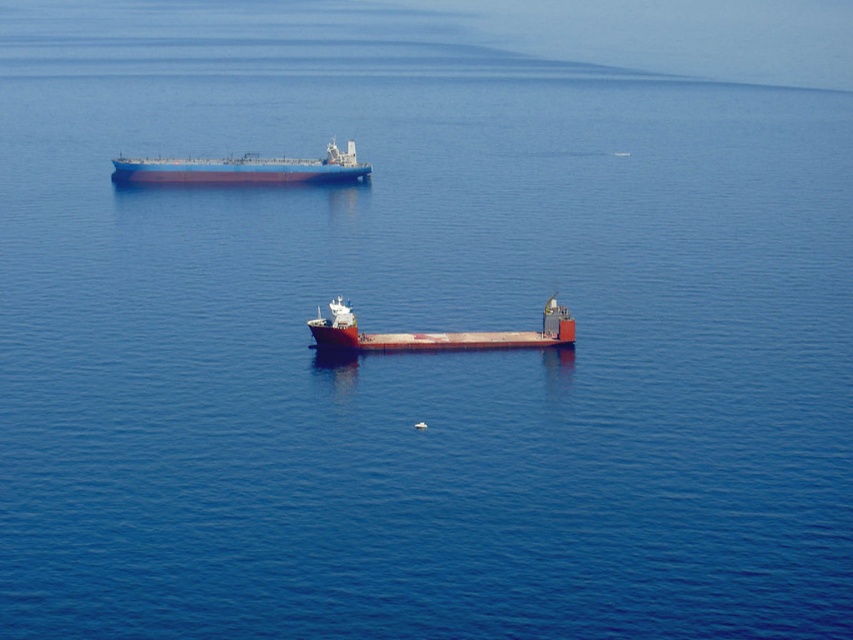
Question: Which object appears closest to the camera in this image?

Choices:
 (A) blue matte tanker at upper left
 (B) smooth red barge at center

Answer: (B)

Question: Does blue matte tanker at upper left lie behind smooth red barge at center?

Choices:
 (A) yes
 (B) no

Answer: (A)

Question: Is blue matte tanker at upper left positioned in front of smooth red barge at center?

Choices:
 (A) no
 (B) yes

Answer: (A)

Question: Is blue matte tanker at upper left below smooth red barge at center?

Choices:
 (A) yes
 (B) no

Answer: (B)

Question: Which object appears farthest from the camera in this image?

Choices:
 (A) smooth red barge at center
 (B) blue matte tanker at upper left

Answer: (B)